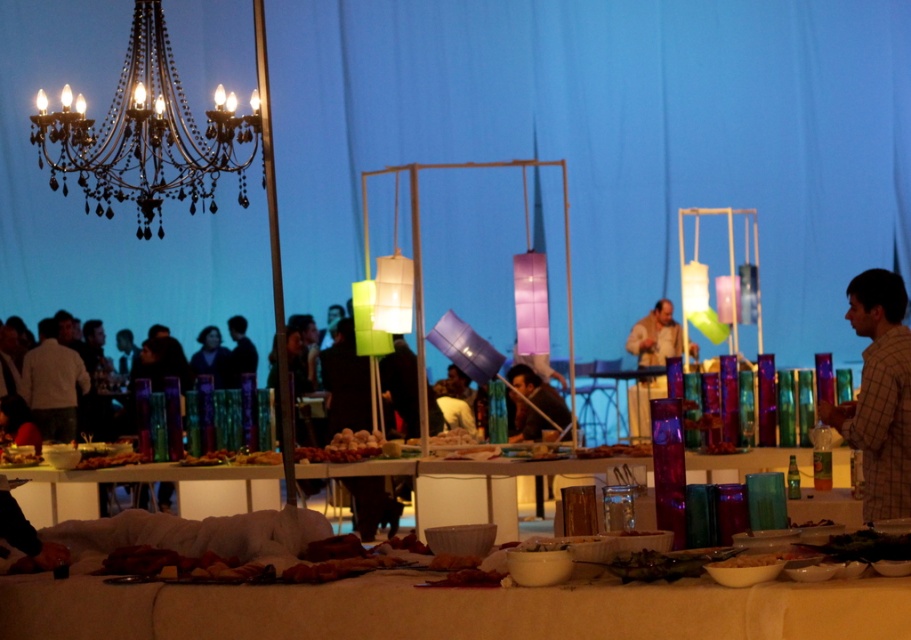
Question: Based on their relative distances, which object is farther from the black crystal chandelier at upper left?

Choices:
 (A) white glossy bowl at center
 (B) translucent glass jars at center
 (C) white matte table at lower center

Answer: (C)

Question: Is white matte table at lower center bigger than white glossy bowl at center?

Choices:
 (A) yes
 (B) no

Answer: (A)

Question: Which point is farther to the camera?

Choices:
 (A) black crystal chandelier at upper left
 (B) plaid shirt at right
 (C) translucent glass jars at center
 (D) white matte table at lower center

Answer: (A)

Question: Which point is farther to the camera?

Choices:
 (A) plaid shirt at right
 (B) translucent glass jars at center
 (C) white glossy bowl at center

Answer: (C)

Question: Can you confirm if translucent glass jars at center is smaller than plaid shirt at right?

Choices:
 (A) yes
 (B) no

Answer: (B)

Question: Does black crystal chandelier at upper left appear on the left side of plaid shirt at right?

Choices:
 (A) no
 (B) yes

Answer: (B)